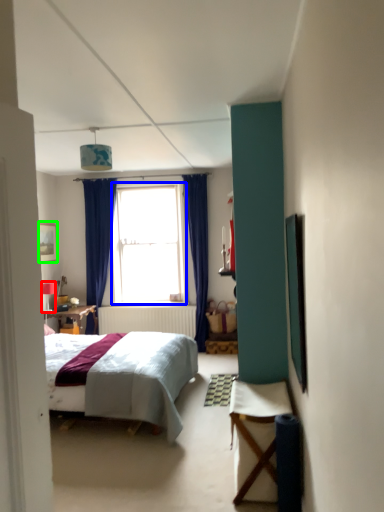
Question: Based on their relative distances, which object is farther from lamp (highlighted by a red box)? Choose from window (highlighted by a blue box) and picture frame (highlighted by a green box).

Choices:
 (A) window
 (B) picture frame

Answer: (A)